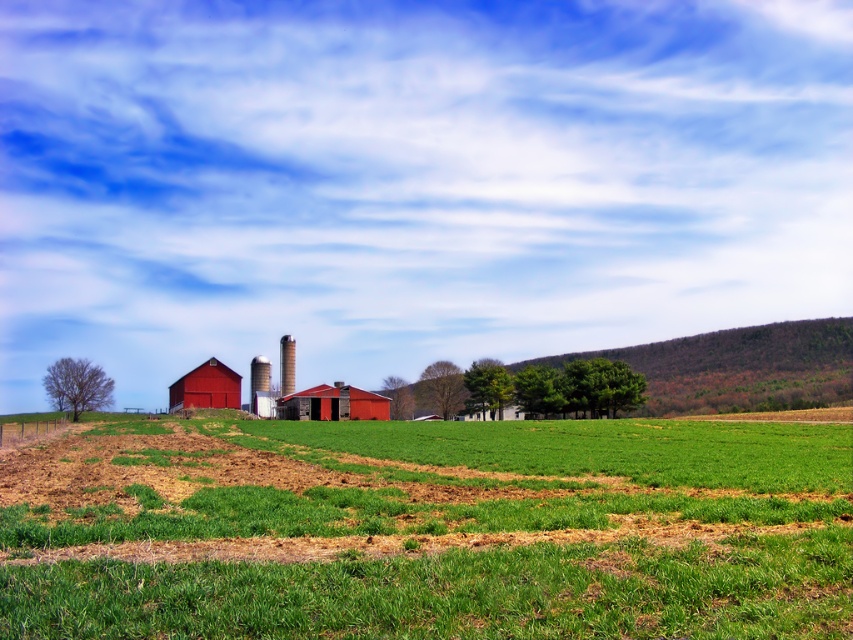
You are a farmer planning to paint both the matte red barn at center and the matte red barn at left. If the smaller barn requires 10 liters of paint, how much paint do you estimate the larger barn would need?

Since the matte red barn at center is smaller than the matte red barn at left, the larger barn would require more paint. If the smaller one needs 10 liters, the larger one might need approximately 15 liters, assuming similar surface area scaling.

You are standing at the camera position looking at the rural landscape. There is a point marked at coordinates point (x=88, y=512). Can you walk directly to that point from your current position without any obstacles?

The point (x=88, y=512) is 14.88 meters away from the camera. Since the scene describes a freshly plowed field with patches of green grass and brown earth in the foreground sloping towards farm buildings, there are no mentioned obstacles between the camera and the point. Therefore, you can walk directly to the point without any obstacles.

You are a farmer who wants to plant a row of sunflowers in the green grassy field at center. Since the rustic metal silo at center is in the way, can you estimate whether there is enough space to plant the sunflowers around the silo?

The green grassy field at center is bigger than rustic metal silo at center, so there is enough space to plant the sunflowers around the silo.